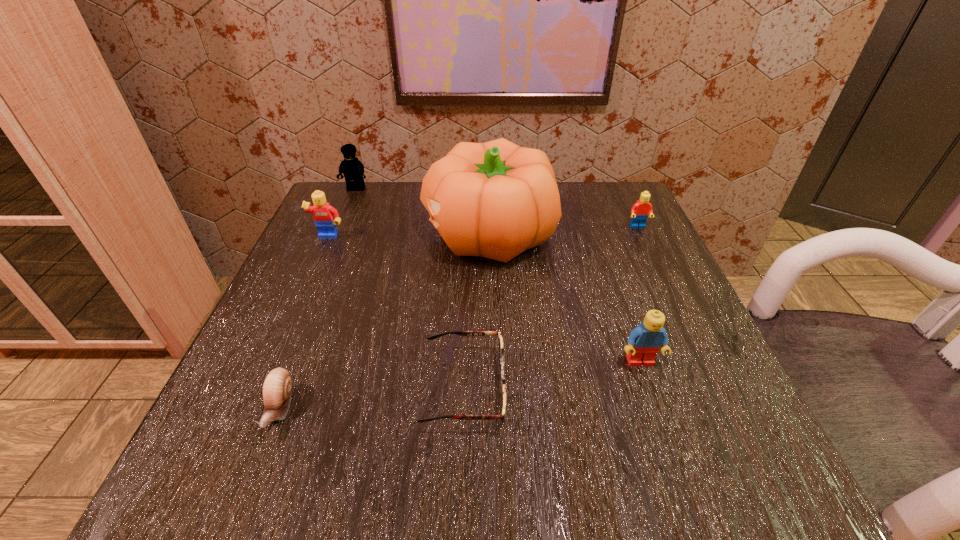
Find the location of a particular element. object that can be found as the sixth closest to the third farthest Lego is located at coordinates (639, 212).

Select which object appears as the fifth closest to the tallest object. Please provide its 2D coordinates. Your answer should be formatted as a tuple, i.e. [(x, y)], where the tuple contains the x and y coordinates of a point satisfying the conditions above.

[(645, 341)]

Find the location of `the fourth closest Lego to the tallest object`. the fourth closest Lego to the tallest object is located at coordinates (645, 341).

The image size is (960, 540). In order to click on the third closest Lego to the second nearest Lego in this screenshot , I will do `click(639, 212)`.

Find the location of a particular element. The height and width of the screenshot is (540, 960). vacant area in the image that satisfies the following two spatial constraints: 1. on the face of the fifth tallest object; 2. on the frame of the shortest object is located at coordinates (713, 388).

Locate an element on the screen. The width and height of the screenshot is (960, 540). blank area in the image that satisfies the following two spatial constraints: 1. on the face of the nearest Lego; 2. on the frame of the spectacles is located at coordinates 649,388.

What are the coordinates of `free spot that satisfies the following two spatial constraints: 1. on the face of the third shortest object; 2. on the frame of the spectacles` in the screenshot? It's located at (713, 388).

Where is `vacant position in the image that satisfies the following two spatial constraints: 1. on the face of the second farthest Lego; 2. on the frame of the spectacles`? The width and height of the screenshot is (960, 540). vacant position in the image that satisfies the following two spatial constraints: 1. on the face of the second farthest Lego; 2. on the frame of the spectacles is located at coordinates (713, 388).

Find the location of a particular element. This screenshot has width=960, height=540. vacant space that satisfies the following two spatial constraints: 1. on the face of the fifth tallest object; 2. on the carved face of the pumpkin is located at coordinates (640, 234).